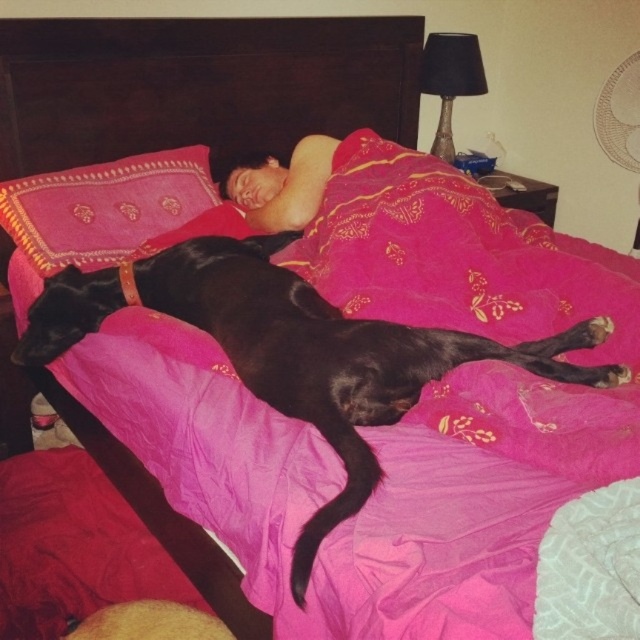
Question: Does black smooth dog at center have a greater width compared to pink embroidered pillow at upper left?

Choices:
 (A) yes
 (B) no

Answer: (A)

Question: Does black smooth dog at center appear on the left side of pink embroidered pillow at upper left?

Choices:
 (A) no
 (B) yes

Answer: (A)

Question: Which point is closer to the camera?

Choices:
 (A) (28, 221)
 (B) (250, 340)

Answer: (B)

Question: Does black smooth dog at center appear under pink embroidered pillow at upper left?

Choices:
 (A) yes
 (B) no

Answer: (A)

Question: Which of the following is the farthest from the observer?

Choices:
 (A) pink embroidered pillow at upper left
 (B) smooth skin person at center
 (C) black smooth dog at center

Answer: (B)

Question: Which of these objects is positioned closest to the black smooth dog at center?

Choices:
 (A) pink embroidered pillow at upper left
 (B) smooth skin person at center

Answer: (A)